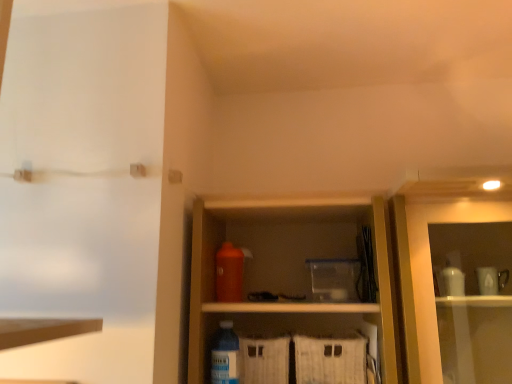
Locate an element on the screen. Image resolution: width=512 pixels, height=384 pixels. orange matte bottle at center, the 1th bottle when ordered from top to bottom is located at coordinates (229, 273).

Locate an element on the screen. The image size is (512, 384). translucent plastic bottle at lower center, the 2th bottle from the top is located at coordinates (225, 355).

Measure the distance between transparent plastic screen door at upper left and camera.

3.28 feet.

Image resolution: width=512 pixels, height=384 pixels. What are the coordinates of `orange matte bottle at center, the second bottle positioned from the bottom` in the screenshot? It's located at (229, 273).

Between point (222, 348) and point (115, 225), which one is positioned behind?

Positioned behind is point (222, 348).

From the picture: Considering the sizes of objects translucent plastic bottle at lower center, which ranks as the 1th bottle in bottom-to-top order, and transparent plastic screen door at upper left in the image provided, who is taller, translucent plastic bottle at lower center, which ranks as the 1th bottle in bottom-to-top order, or transparent plastic screen door at upper left?

Standing taller between the two is transparent plastic screen door at upper left.

From the image's perspective, count 2nd bottles downward from the transparent plastic screen door at upper left and point to it. Please provide its 2D coordinates.

[(225, 355)]

Based on the photo, in terms of size, does translucent plastic bottle at lower center, which ranks as the 1th bottle in bottom-to-top order, appear bigger or smaller than transparent plastic screen door at upper left?

In the image, translucent plastic bottle at lower center, which ranks as the 1th bottle in bottom-to-top order, appears to be smaller than transparent plastic screen door at upper left.

Consider the image. Which object is further away from the camera taking this photo, translucent plastic bottle at lower center, which ranks as the 1th bottle in bottom-to-top order, or orange matte bottle at center, which is the 2th bottle in front-to-back order?

orange matte bottle at center, which is the 2th bottle in front-to-back order.

From a real-world perspective, between translucent plastic bottle at lower center, the 2th bottle viewed from the back, and orange matte bottle at center, the 1th bottle positioned from the back, who is vertically higher?

orange matte bottle at center, the 1th bottle positioned from the back.

Does point (231, 332) appear closer or farther from the camera than point (237, 258)?

Point (231, 332).

Does transparent plastic screen door at upper left have a greater height compared to translucent plastic bottle at lower center, which ranks as the 1th bottle in bottom-to-top order?

Correct, transparent plastic screen door at upper left is much taller as translucent plastic bottle at lower center, which ranks as the 1th bottle in bottom-to-top order.

Is translucent plastic bottle at lower center, the 2th bottle viewed from the back, a part of transparent plastic screen door at upper left?

That's incorrect, translucent plastic bottle at lower center, the 2th bottle viewed from the back, is not inside transparent plastic screen door at upper left.

Is transparent plastic screen door at upper left to the right of translucent plastic bottle at lower center, the first bottle from the front, from the viewer's perspective?

No, transparent plastic screen door at upper left is not to the right of translucent plastic bottle at lower center, the first bottle from the front.

From a real-world perspective, which object rests below the other?

translucent plastic bottle at lower center, the 2th bottle viewed from the back, from a real-world perspective.

Is transparent plastic screen door at upper left turned away from orange matte bottle at center, the 1th bottle positioned from the back?

No, transparent plastic screen door at upper left's orientation is not away from orange matte bottle at center, the 1th bottle positioned from the back.

From the image's perspective, relative to orange matte bottle at center, the 1th bottle when ordered from top to bottom, is transparent plastic screen door at upper left above or below?

Based on their image positions, transparent plastic screen door at upper left is located above orange matte bottle at center, the 1th bottle when ordered from top to bottom.

Based on their positions, is transparent plastic screen door at upper left located to the left or right of orange matte bottle at center, which is the 2th bottle in front-to-back order?

Clearly, transparent plastic screen door at upper left is on the left of orange matte bottle at center, which is the 2th bottle in front-to-back order, in the image.

Do you think orange matte bottle at center, the 1th bottle when ordered from top to bottom, is within translucent plastic bottle at lower center, the 2th bottle from the top, or outside of it?

orange matte bottle at center, the 1th bottle when ordered from top to bottom, is not inside translucent plastic bottle at lower center, the 2th bottle from the top, it's outside.

Which object is positioned more to the left, orange matte bottle at center, the second bottle positioned from the bottom, or translucent plastic bottle at lower center, the 2th bottle viewed from the back?

translucent plastic bottle at lower center, the 2th bottle viewed from the back.

From the image's perspective, does orange matte bottle at center, the 1th bottle positioned from the back, appear lower than translucent plastic bottle at lower center, the 2th bottle from the top?

Actually, orange matte bottle at center, the 1th bottle positioned from the back, appears above translucent plastic bottle at lower center, the 2th bottle from the top, in the image.

Considering the relative sizes of orange matte bottle at center, which is the 2th bottle in front-to-back order, and translucent plastic bottle at lower center, the 2th bottle from the top, in the image provided, is orange matte bottle at center, which is the 2th bottle in front-to-back order, smaller than translucent plastic bottle at lower center, the 2th bottle from the top,?

No, orange matte bottle at center, which is the 2th bottle in front-to-back order, is not smaller than translucent plastic bottle at lower center, the 2th bottle from the top.

Measure the distance from orange matte bottle at center, which is the 2th bottle in front-to-back order, to transparent plastic screen door at upper left.

A distance of 21.80 inches exists between orange matte bottle at center, which is the 2th bottle in front-to-back order, and transparent plastic screen door at upper left.

In the image, is orange matte bottle at center, the 1th bottle positioned from the back, positioned in front of or behind transparent plastic screen door at upper left?

Clearly, orange matte bottle at center, the 1th bottle positioned from the back, is behind transparent plastic screen door at upper left.

Can you confirm if orange matte bottle at center, the 1th bottle when ordered from top to bottom, is bigger than transparent plastic screen door at upper left?

Incorrect, orange matte bottle at center, the 1th bottle when ordered from top to bottom, is not larger than transparent plastic screen door at upper left.

Is orange matte bottle at center, the 1th bottle positioned from the back, situated inside transparent plastic screen door at upper left or outside?

orange matte bottle at center, the 1th bottle positioned from the back, lies outside transparent plastic screen door at upper left.

At what (x,y) coordinates should I click in order to perform the action: click on screen door located above the translucent plastic bottle at lower center, which ranks as the 1th bottle in bottom-to-top order (from a real-world perspective). Please return your answer as a coordinate pair (x, y). Looking at the image, I should click on (83, 184).

I want to click on bottle lying on the right of translucent plastic bottle at lower center, which ranks as the 1th bottle in bottom-to-top order, so click(229, 273).

When comparing their distances from orange matte bottle at center, the 1th bottle when ordered from top to bottom, does transparent plastic screen door at upper left or translucent plastic bottle at lower center, the first bottle from the front, seem closer?

translucent plastic bottle at lower center, the first bottle from the front.

Looking at the image, which one is located further to transparent plastic screen door at upper left, orange matte bottle at center, the 1th bottle when ordered from top to bottom, or translucent plastic bottle at lower center, the 2th bottle viewed from the back?

The object further to transparent plastic screen door at upper left is translucent plastic bottle at lower center, the 2th bottle viewed from the back.

When comparing their distances from orange matte bottle at center, the 1th bottle positioned from the back, does translucent plastic bottle at lower center, the 2th bottle from the top, or transparent plastic screen door at upper left seem closer?

Based on the image, translucent plastic bottle at lower center, the 2th bottle from the top, appears to be nearer to orange matte bottle at center, the 1th bottle positioned from the back.

Based on their spatial positions, is orange matte bottle at center, the 1th bottle when ordered from top to bottom, or transparent plastic screen door at upper left further from translucent plastic bottle at lower center, the first bottle from the front?

transparent plastic screen door at upper left is positioned further to the anchor translucent plastic bottle at lower center, the first bottle from the front.

Based on their spatial positions, is translucent plastic bottle at lower center, the 2th bottle from the top, or orange matte bottle at center, the 1th bottle positioned from the back, closer to transparent plastic screen door at upper left?

orange matte bottle at center, the 1th bottle positioned from the back, is closer to transparent plastic screen door at upper left.

Which object lies nearer to the anchor point translucent plastic bottle at lower center, the 2th bottle from the top, transparent plastic screen door at upper left or orange matte bottle at center, the 1th bottle when ordered from top to bottom?

Based on the image, orange matte bottle at center, the 1th bottle when ordered from top to bottom, appears to be nearer to translucent plastic bottle at lower center, the 2th bottle from the top.

Where is `bottle between transparent plastic screen door at upper left and orange matte bottle at center, which is the 2th bottle in front-to-back order, in the front-back direction`? Image resolution: width=512 pixels, height=384 pixels. bottle between transparent plastic screen door at upper left and orange matte bottle at center, which is the 2th bottle in front-to-back order, in the front-back direction is located at coordinates (225, 355).